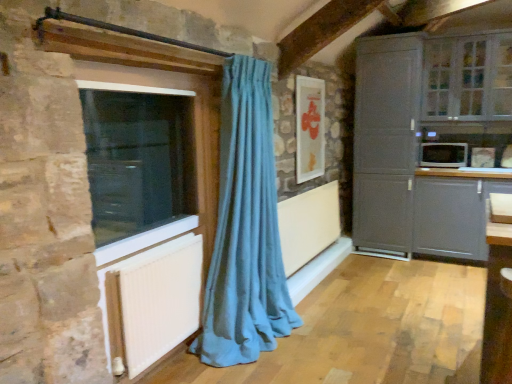
Question: In terms of height, does matte gray cabinet at right look taller or shorter compared to white textured radiator at lower left?

Choices:
 (A) tall
 (B) short

Answer: (A)

Question: Considering the positions of point (382, 134) and point (181, 253), is point (382, 134) closer or farther from the camera than point (181, 253)?

Choices:
 (A) farther
 (B) closer

Answer: (A)

Question: Which of these objects is positioned farthest from the teal fabric curtain at left?

Choices:
 (A) matte gray cabinet at right
 (B) white textured radiator at lower left
 (C) white glossy microwave at right
 (D) matte gray cabinet at lower right
 (E) transparent glass window at left, positioned as the first window in left-to-right order

Answer: (C)

Question: Based on their relative distances, which object is nearer to the white glossy microwave at right?

Choices:
 (A) matte gray cabinet at right
 (B) transparent glass window at left, which is the 1th window from bottom to top
 (C) clear glass cabinet at upper right, marked as the second window in a front-to-back arrangement
 (D) matte gray cabinet at lower right
 (E) white textured radiator at lower left

Answer: (D)